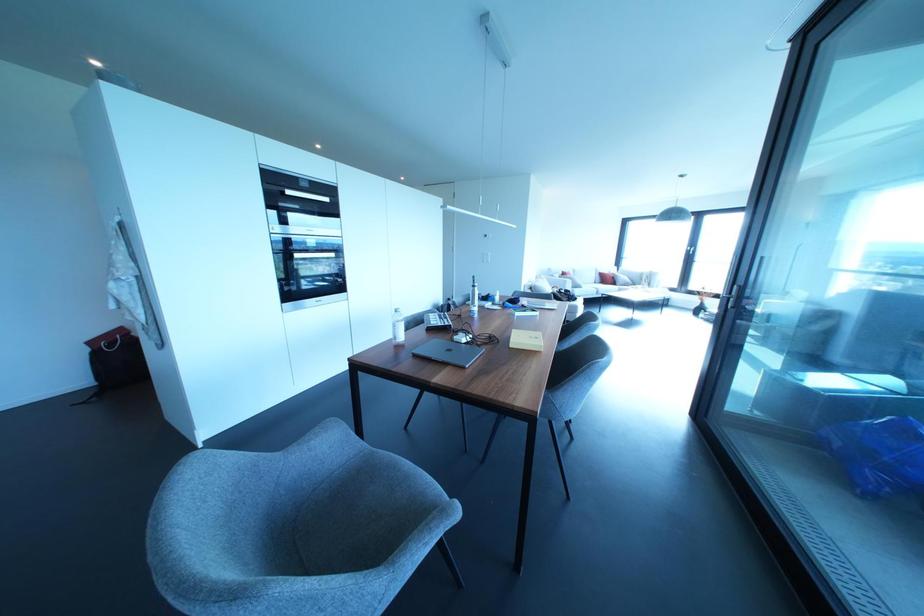
What are the coordinates of `grey chair sitting surface` in the screenshot? It's located at (366, 504).